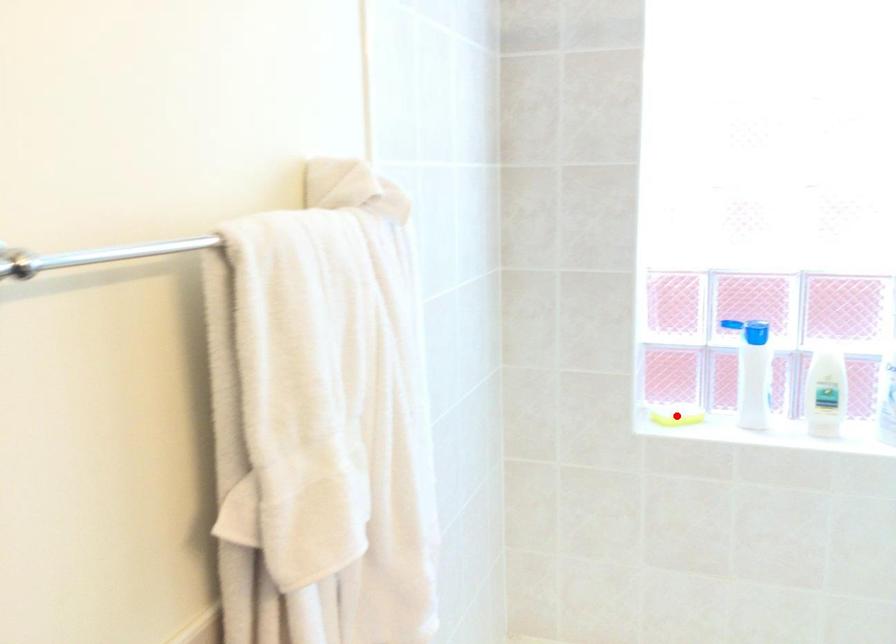
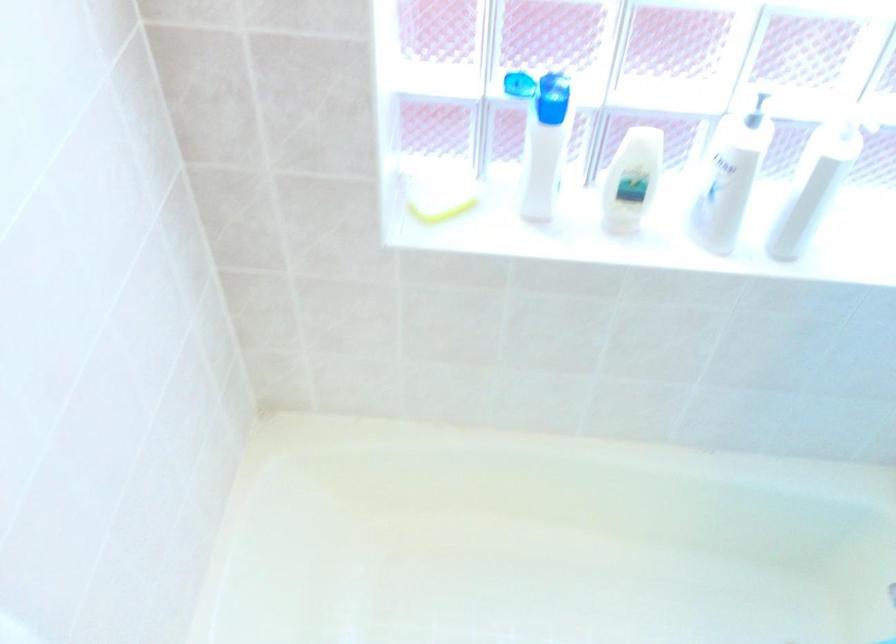
Locate, in the second image, the point that corresponds to the highlighted location in the first image.

(438, 196)